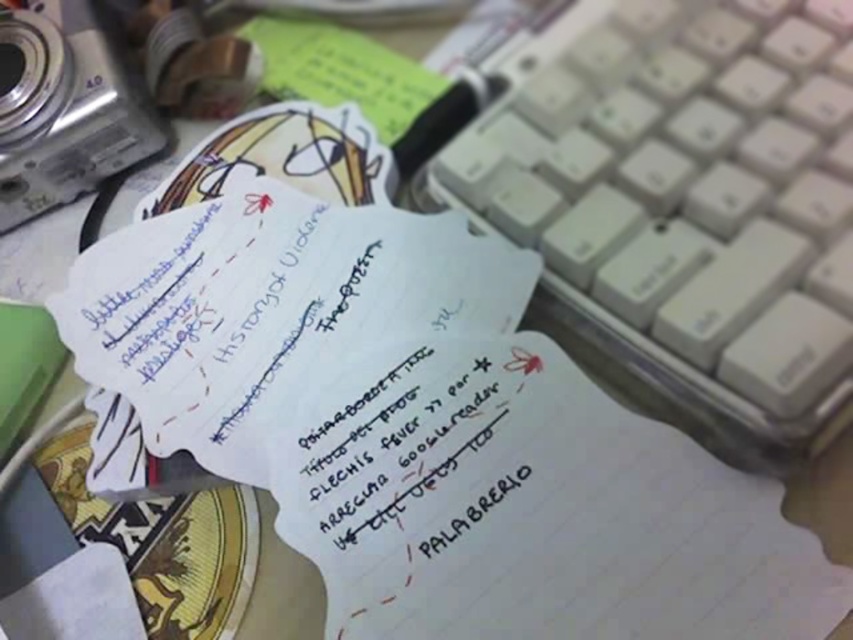
Who is positioned more to the right, white paper at center or green paper at upper center?

white paper at center

In order to click on white paper at center in this screenshot , I will do `click(401, 451)`.

Between silver metallic camera at upper left and green paper at upper center, which one has less height?

With less height is green paper at upper center.

Does silver metallic camera at upper left appear on the right side of green paper at upper center?

Incorrect, silver metallic camera at upper left is not on the right side of green paper at upper center.

Who is more forward, (24, 154) or (357, 74)?

Point (24, 154) is in front.

Locate an element on the screen. The width and height of the screenshot is (853, 640). silver metallic camera at upper left is located at coordinates (64, 108).

Who is positioned more to the right, white plastic keyboard at center or green paper at upper center?

white plastic keyboard at center

Is point (743, 221) behind point (305, 83)?

That is False.

Find the location of a particular element. Image resolution: width=853 pixels, height=640 pixels. white plastic keyboard at center is located at coordinates (683, 209).